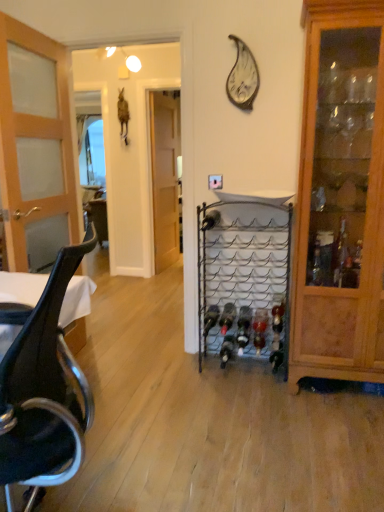
You are a GUI agent. You are given a task and a screenshot of the screen. Output one action in this format:
    pyautogui.click(x=<x>, y=<y>)
    Task: Click on the blank area to the left of wooden cabinet at right
    The image size is (384, 512).
    Given the screenshot: What is the action you would take?
    pyautogui.click(x=266, y=400)